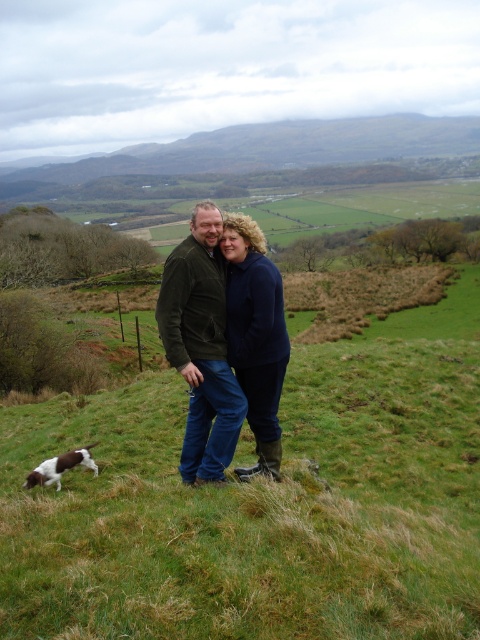
Which is in front, point (177, 528) or point (225, 387)?

Positioned in front is point (177, 528).

Locate an element on the screen. The image size is (480, 640). green grassy hillside at center is located at coordinates (263, 502).

Image resolution: width=480 pixels, height=640 pixels. What do you see at coordinates (263, 502) in the screenshot?
I see `green grassy hillside at center` at bounding box center [263, 502].

Image resolution: width=480 pixels, height=640 pixels. Find the location of `green grassy hillside at center`. green grassy hillside at center is located at coordinates (263, 502).

Is green grassy hillside at center positioned in front of brown speckled fur at lower left?

Yes, green grassy hillside at center is in front of brown speckled fur at lower left.

Who is higher up, green grassy hillside at center or brown speckled fur at lower left?

green grassy hillside at center

Which is behind, point (179, 580) or point (52, 481)?

The point (52, 481) is behind.

The height and width of the screenshot is (640, 480). I want to click on green grassy hillside at center, so click(x=263, y=502).

Which is behind, point (35, 170) or point (208, 314)?

The point (35, 170) is more distant.

Does green grassy hillside at upper center come in front of dark green corduroy jacket at center?

No, green grassy hillside at upper center is further to the viewer.

Where is `green grassy hillside at upper center`? This screenshot has width=480, height=640. green grassy hillside at upper center is located at coordinates (273, 148).

The height and width of the screenshot is (640, 480). What are the coordinates of `green grassy hillside at upper center` in the screenshot? It's located at (273, 148).